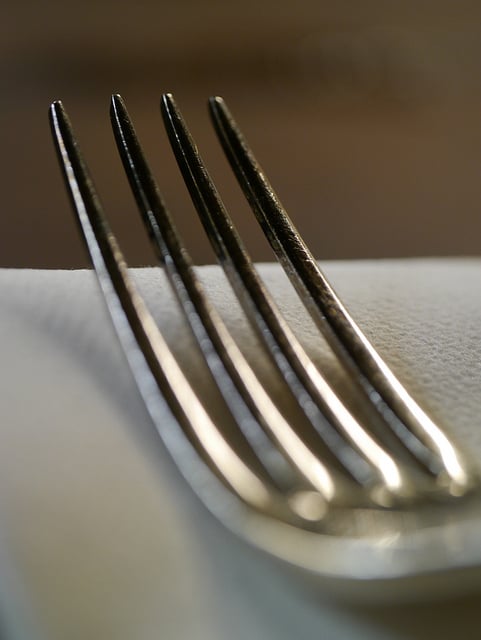
Identify the location of edge of napkin. (65, 269).